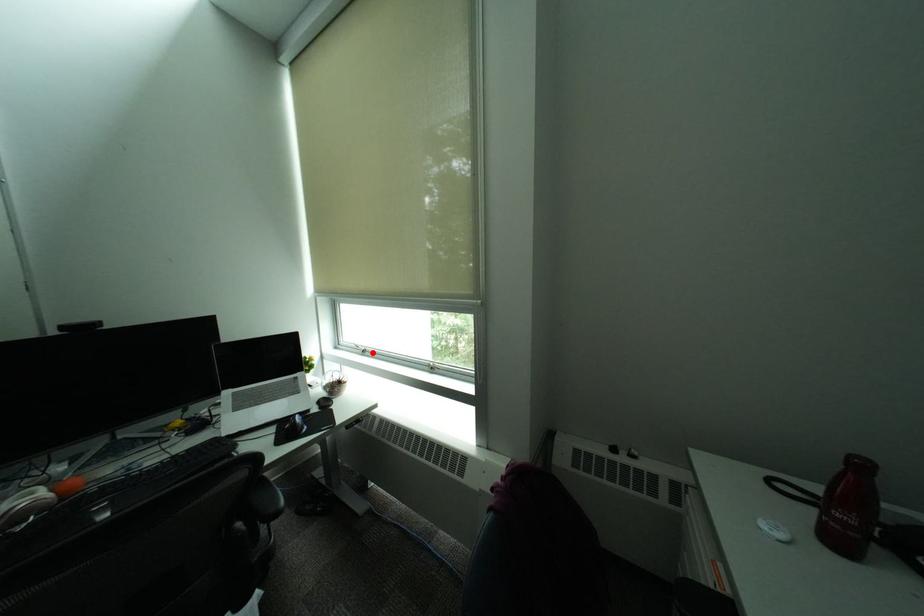
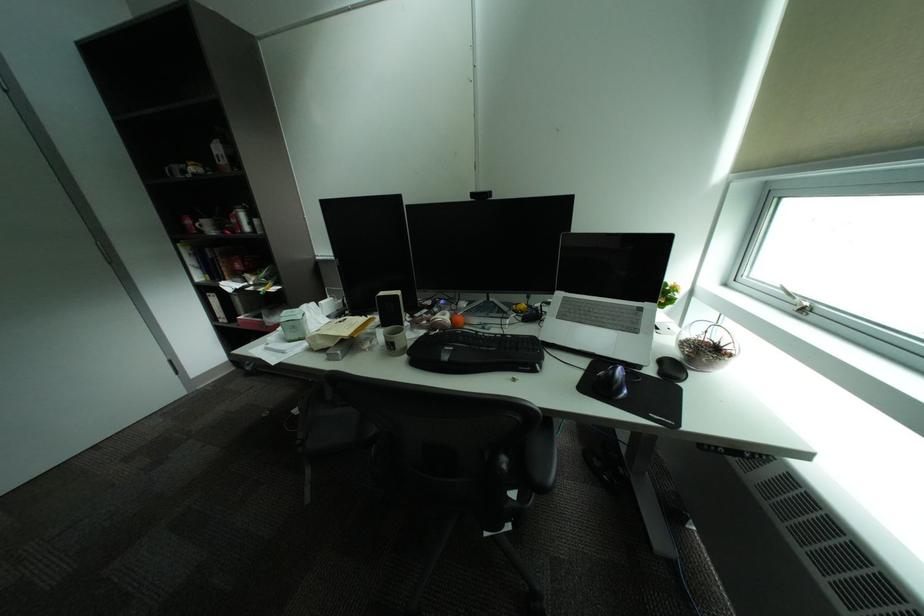
In the second image, find the point that corresponds to the highlighted location in the first image.

(808, 310)